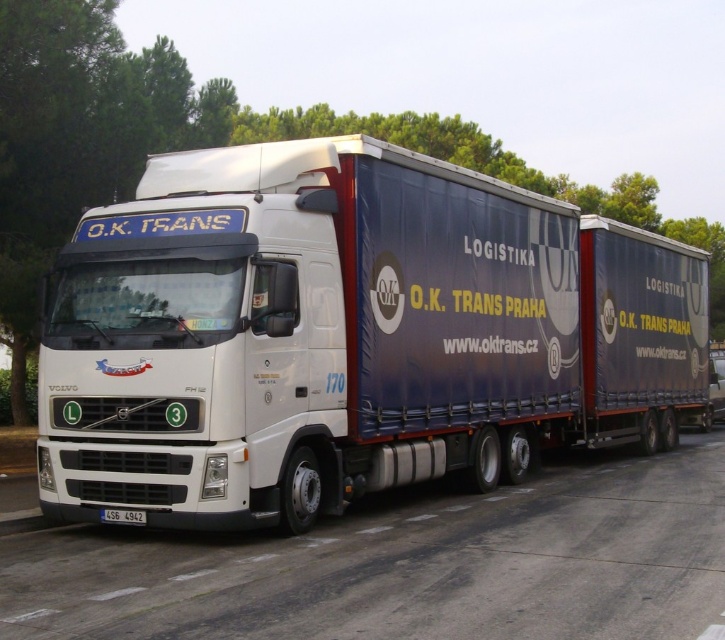
Who is shorter, white matte truck at center or white plastic license plate at center?

white plastic license plate at center

The height and width of the screenshot is (640, 725). Identify the location of white matte truck at center. (348, 333).